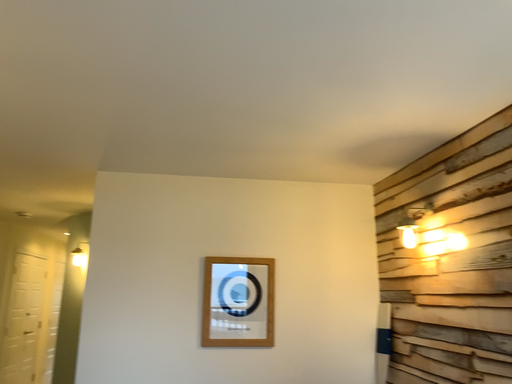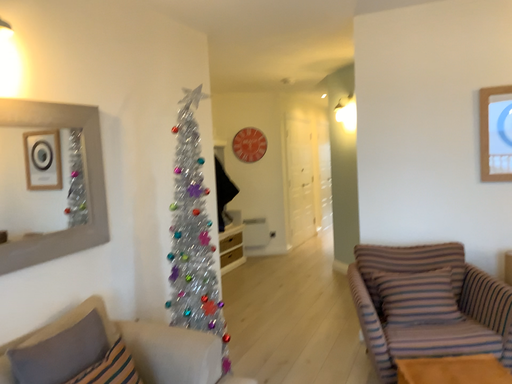
Question: Which way did the camera rotate in the video?

Choices:
 (A) rotated left
 (B) rotated right

Answer: (A)